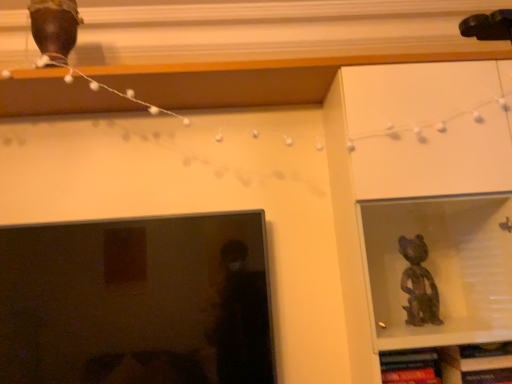
Find the location of a particular element. Image resolution: width=512 pixels, height=384 pixels. wooden bookshelf at lower right is located at coordinates (449, 365).

Describe the element at coordinates (449, 365) in the screenshot. I see `wooden bookshelf at lower right` at that location.

Locate an element on the screen. matte black tv at left is located at coordinates (137, 301).

Describe the element at coordinates (137, 301) in the screenshot. I see `matte black tv at left` at that location.

You are a GUI agent. You are given a task and a screenshot of the screen. Output one action in this format:
    pyautogui.click(x=<x>, y=<y>)
    Task: Click on the wooden bookshelf at lower right
    This screenshot has height=384, width=512.
    Given the screenshot: What is the action you would take?
    pyautogui.click(x=449, y=365)

Is wooden bookshelf at lower right at the left side of matte black tv at left?

Incorrect, wooden bookshelf at lower right is not on the left side of matte black tv at left.

Based on the photo, does wooden bookshelf at lower right lie behind matte black tv at left?

Yes, it is.

Is point (388, 353) positioned behind point (234, 239)?

No, it is not.

From the image's perspective, would you say wooden bookshelf at lower right is positioned over matte black tv at left?

Incorrect, from the image's perspective, wooden bookshelf at lower right is lower than matte black tv at left.

In the scene shown: From a real-world perspective, does wooden bookshelf at lower right stand above matte black tv at left?

No, from a real-world perspective, wooden bookshelf at lower right is not on top of matte black tv at left.

Is wooden bookshelf at lower right wider or thinner than matte black tv at left?

Clearly, wooden bookshelf at lower right has more width compared to matte black tv at left.

Considering the sizes of objects wooden bookshelf at lower right and matte black tv at left in the image provided, who is shorter, wooden bookshelf at lower right or matte black tv at left?

Standing shorter between the two is wooden bookshelf at lower right.

Can you confirm if wooden bookshelf at lower right is smaller than matte black tv at left?

Correct, wooden bookshelf at lower right occupies less space than matte black tv at left.

Can we say wooden bookshelf at lower right lies outside matte black tv at left?

Yes, wooden bookshelf at lower right is outside of matte black tv at left.

Are wooden bookshelf at lower right and matte black tv at left far apart?

No, there isn't a large distance between wooden bookshelf at lower right and matte black tv at left.

Does wooden bookshelf at lower right turn towards matte black tv at left?

No, wooden bookshelf at lower right is not aimed at matte black tv at left.

In order to click on picture frame lying on the left of wooden bookshelf at lower right in this screenshot , I will do `click(137, 301)`.

Is matte black tv at left to the left or to the right of wooden bookshelf at lower right in the image?

matte black tv at left is positioned on wooden bookshelf at lower right's left side.

Between matte black tv at left and wooden bookshelf at lower right, which one is positioned in front?

matte black tv at left is more forward.

Is point (237, 352) positioned before point (488, 363)?

That is False.

From the image's perspective, which object appears higher, matte black tv at left or wooden bookshelf at lower right?

matte black tv at left, from the image's perspective.

From a real-world perspective, which object stands above the other?

matte black tv at left, from a real-world perspective.

Can you confirm if matte black tv at left is thinner than wooden bookshelf at lower right?

Indeed, matte black tv at left has a lesser width compared to wooden bookshelf at lower right.

Is matte black tv at left taller or shorter than wooden bookshelf at lower right?

Clearly, matte black tv at left is taller compared to wooden bookshelf at lower right.

Based on the photo, considering the relative sizes of matte black tv at left and wooden bookshelf at lower right in the image provided, is matte black tv at left bigger than wooden bookshelf at lower right?

Yes.

Is wooden bookshelf at lower right surrounded by matte black tv at left?

No.

Is matte black tv at left touching wooden bookshelf at lower right?

No.

Is matte black tv at left turned away from wooden bookshelf at lower right?

No, matte black tv at left is not facing the opposite direction of wooden bookshelf at lower right.

What's the angular difference between matte black tv at left and wooden bookshelf at lower right's facing directions?

matte black tv at left and wooden bookshelf at lower right are facing 2.65 degrees away from each other.

Where is `shelf located on the right of matte black tv at left`? The height and width of the screenshot is (384, 512). shelf located on the right of matte black tv at left is located at coordinates (449, 365).

The height and width of the screenshot is (384, 512). Find the location of `shelf below the matte black tv at left (from the image's perspective)`. shelf below the matte black tv at left (from the image's perspective) is located at coordinates (449, 365).

You are a GUI agent. You are given a task and a screenshot of the screen. Output one action in this format:
    pyautogui.click(x=<x>, y=<y>)
    Task: Click on the shelf behind the matte black tv at left
    Image resolution: width=512 pixels, height=384 pixels.
    Given the screenshot: What is the action you would take?
    pyautogui.click(x=449, y=365)